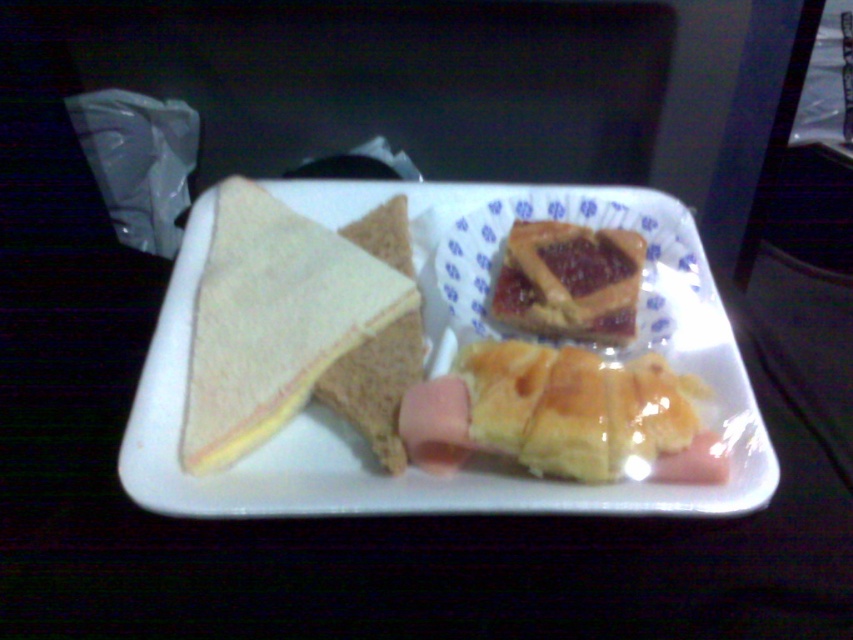
You are setting up a picnic and have a white paper plate at center and a glazed pastry at center. Which item can hold more food items?

The white paper plate at center has a larger size compared to the glazed pastry at center, so it can hold more food items.

You are a food delivery person who needs to deliver this meal to a customer. The customer has requested that the pastry be placed in the center of the tray. Is the current arrangement of the white bread sandwich at upper left and the glazed pastry at center meeting the customer requirement?

The glazed pastry at center is already placed in the center of the tray, so the current arrangement meets the customer requirement.